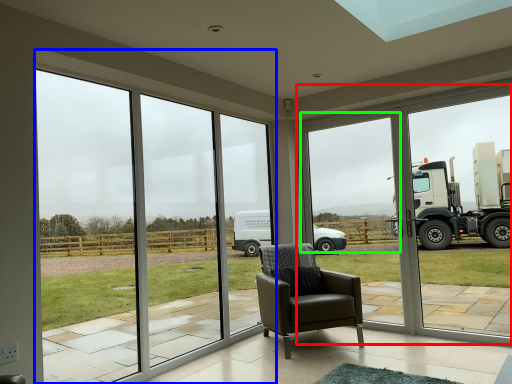
Question: Estimate the real-world distances between objects in this image. Which object is closer to window frame (highlighted by a red box), window (highlighted by a blue box) or window screen (highlighted by a green box)?

Choices:
 (A) window
 (B) window screen

Answer: (B)